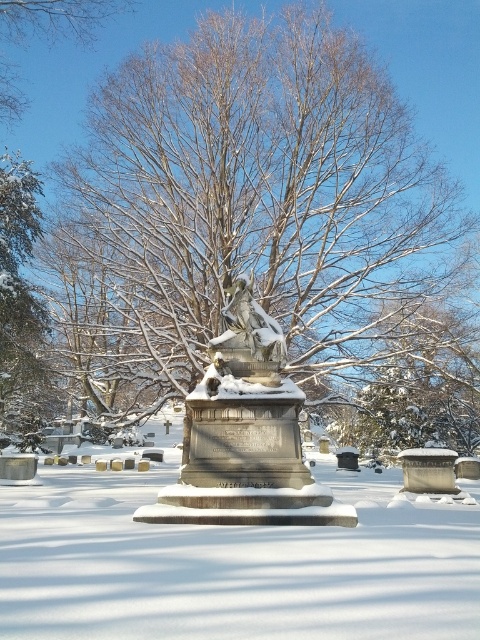
You are standing in a winter cemetery and see the white powdery snow at center and the green textured evergreen tree at left. Which object is taller?

The green textured evergreen tree at left is taller than the white powdery snow at center.